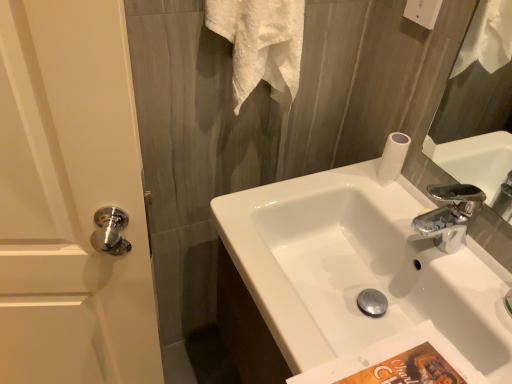
Question: Is white textured towel at upper center smaller than white glossy sink at center?

Choices:
 (A) yes
 (B) no

Answer: (A)

Question: Can you see white textured towel at upper center touching white glossy sink at center?

Choices:
 (A) yes
 (B) no

Answer: (B)

Question: From a real-world perspective, is white textured towel at upper center beneath white glossy sink at center?

Choices:
 (A) no
 (B) yes

Answer: (A)

Question: Is white glossy sink at center surrounded by white textured towel at upper center?

Choices:
 (A) yes
 (B) no

Answer: (B)

Question: Is white textured towel at upper center bigger than white glossy sink at center?

Choices:
 (A) yes
 (B) no

Answer: (B)

Question: Can you confirm if white textured towel at upper center is positioned to the left of white glossy sink at center?

Choices:
 (A) yes
 (B) no

Answer: (A)

Question: From a real-world perspective, is white glossy sink at center on top of white glossy door handle at left?

Choices:
 (A) no
 (B) yes

Answer: (B)

Question: From the image's perspective, is white glossy sink at center above white glossy door handle at left?

Choices:
 (A) no
 (B) yes

Answer: (B)

Question: Considering the relative positions of white glossy sink at center and white glossy door handle at left in the image provided, is white glossy sink at center to the right of white glossy door handle at left from the viewer's perspective?

Choices:
 (A) yes
 (B) no

Answer: (A)

Question: Considering the relative sizes of white glossy sink at center and white glossy door handle at left in the image provided, is white glossy sink at center bigger than white glossy door handle at left?

Choices:
 (A) yes
 (B) no

Answer: (B)

Question: Is white glossy sink at center facing away from white glossy door handle at left?

Choices:
 (A) yes
 (B) no

Answer: (B)

Question: Are white glossy sink at center and white glossy door handle at left located far from each other?

Choices:
 (A) no
 (B) yes

Answer: (A)

Question: Is white glossy door handle at left positioned beyond the bounds of white glossy sink at center?

Choices:
 (A) no
 (B) yes

Answer: (B)